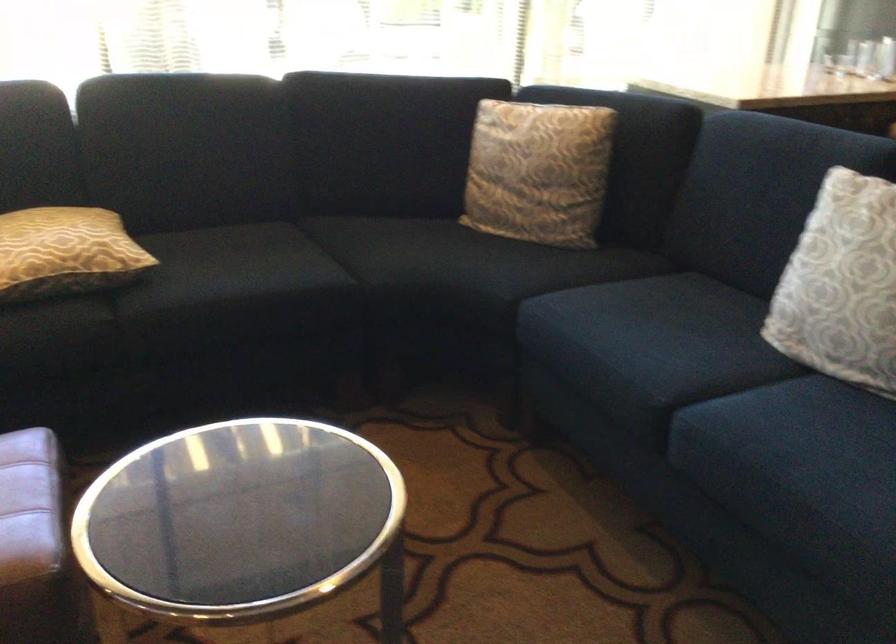
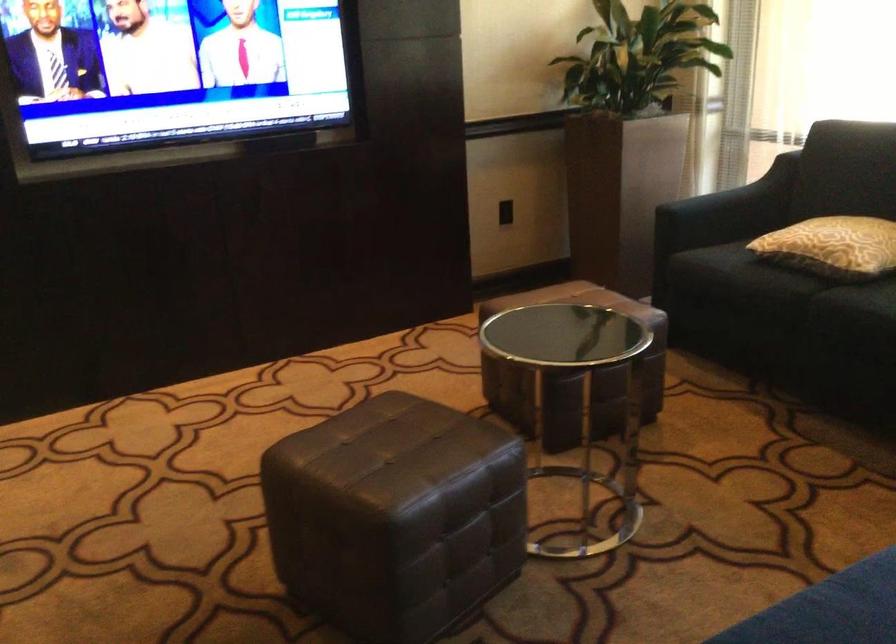
Locate, in the second image, the point that corresponds to pixel 100 254 in the first image.

(832, 245)